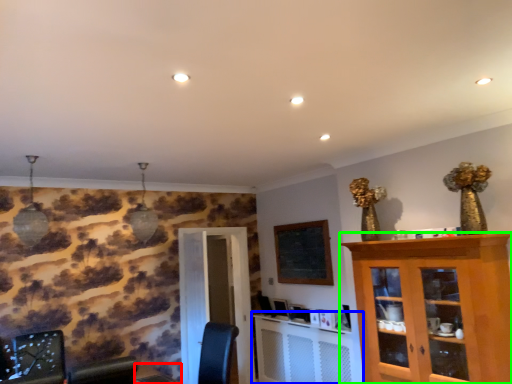
Question: Which object is the farthest from table (highlighted by a red box)? Choose among these: computer desk (highlighted by a blue box) or cabinetry (highlighted by a green box).

Choices:
 (A) computer desk
 (B) cabinetry

Answer: (B)